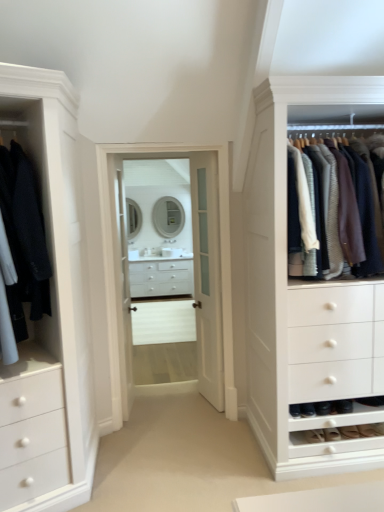
At what (x,y) coordinates should I click in order to perform the action: click on vacant region to the left of white glass door at center. Please return your answer as a coordinate pair (x, y). The width and height of the screenshot is (384, 512). Looking at the image, I should click on (177, 407).